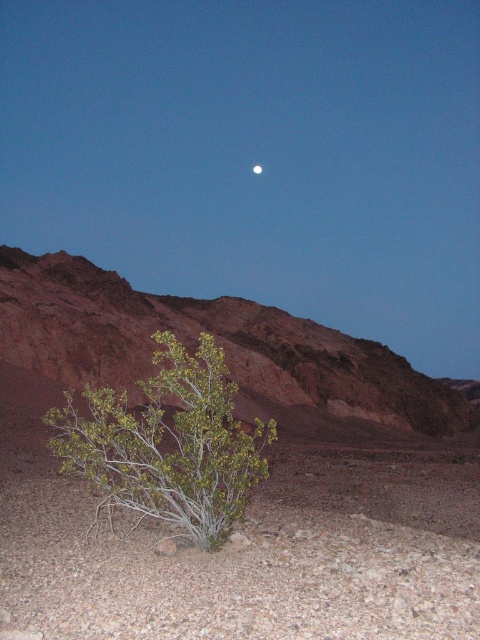
You are an explorer in the desert and want to find shade. You see the green leafy bush at lower center and the green leafy shrub at lower left. Which one provides more shade?

The green leafy bush at lower center is positioned over the green leafy shrub at lower left, so it likely provides more shade because it is larger and covers the shrub.

You are standing at the point marked as point (257,156) in the desert scene. Looking around, you see a green leafy bush at lower center. Which direction should you face to see the full moon in the upper center?

The full moon is in the upper center of the scene. Since you are at point (257,156), which is the green leafy bush at lower center, you should face upward or north to see the full moon in the upper center.